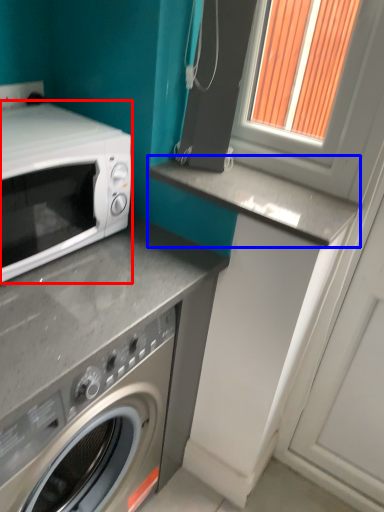
Question: Which of the following is the farthest to the observer, microwave oven (highlighted by a red box) or counter top (highlighted by a blue box)?

Choices:
 (A) microwave oven
 (B) counter top

Answer: (B)